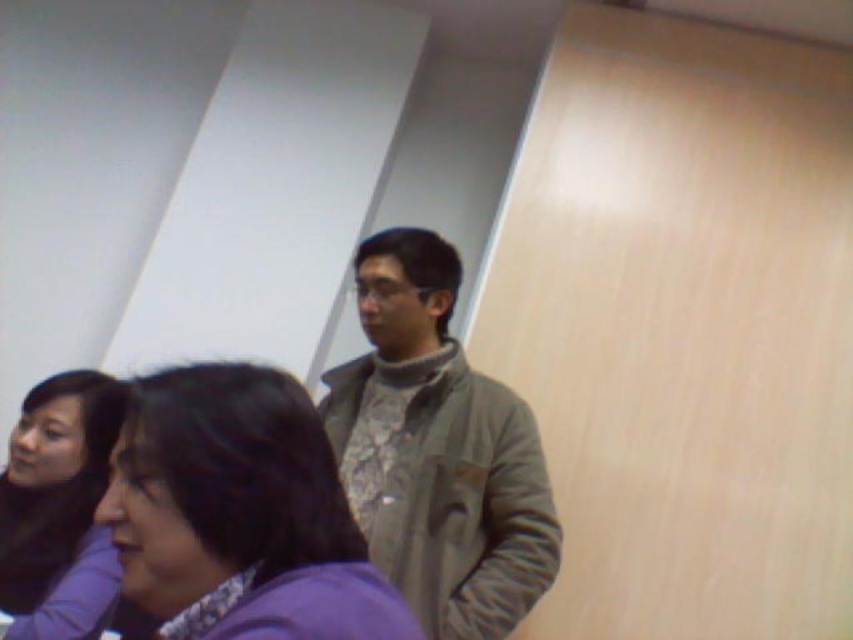
Question: Is gray fabric jacket at center positioned in front of matte black hair at upper left?

Choices:
 (A) yes
 (B) no

Answer: (B)

Question: Among these points, which one is nearest to the camera?

Choices:
 (A) (90, 634)
 (B) (518, 598)
 (C) (137, 554)

Answer: (C)

Question: Which point appears farthest from the camera in this image?

Choices:
 (A) (22, 608)
 (B) (120, 432)

Answer: (A)

Question: Does gray fabric jacket at center appear over matte black hair at upper left?

Choices:
 (A) no
 (B) yes

Answer: (B)

Question: Is purple fabric at center positioned at the back of matte black hair at upper left?

Choices:
 (A) no
 (B) yes

Answer: (A)

Question: Which point is closer to the camera taking this photo?

Choices:
 (A) (534, 484)
 (B) (302, 403)
 (C) (35, 460)

Answer: (B)